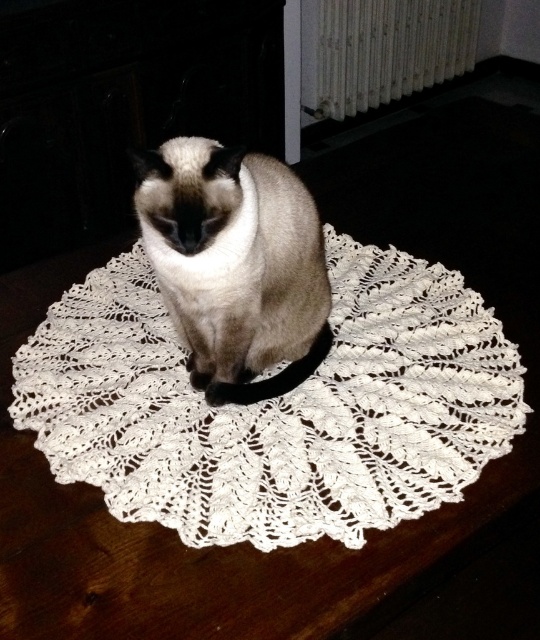
Question: Which point appears farthest from the camera in this image?

Choices:
 (A) (266, 372)
 (B) (172, 160)

Answer: (A)

Question: Can you confirm if white lace doily at center is thinner than silky fur cat at center?

Choices:
 (A) no
 (B) yes

Answer: (A)

Question: Which point is farther to the camera?

Choices:
 (A) white lace doily at center
 (B) white textured radiator at upper center
 (C) silky fur cat at center

Answer: (B)

Question: Which point is closer to the camera?

Choices:
 (A) white textured radiator at upper center
 (B) white lace doily at center
 (C) silky fur cat at center

Answer: (B)

Question: Does white lace doily at center appear on the left side of silky fur cat at center?

Choices:
 (A) yes
 (B) no

Answer: (B)

Question: Considering the relative positions of white lace doily at center and silky fur cat at center in the image provided, where is white lace doily at center located with respect to silky fur cat at center?

Choices:
 (A) left
 (B) right

Answer: (B)